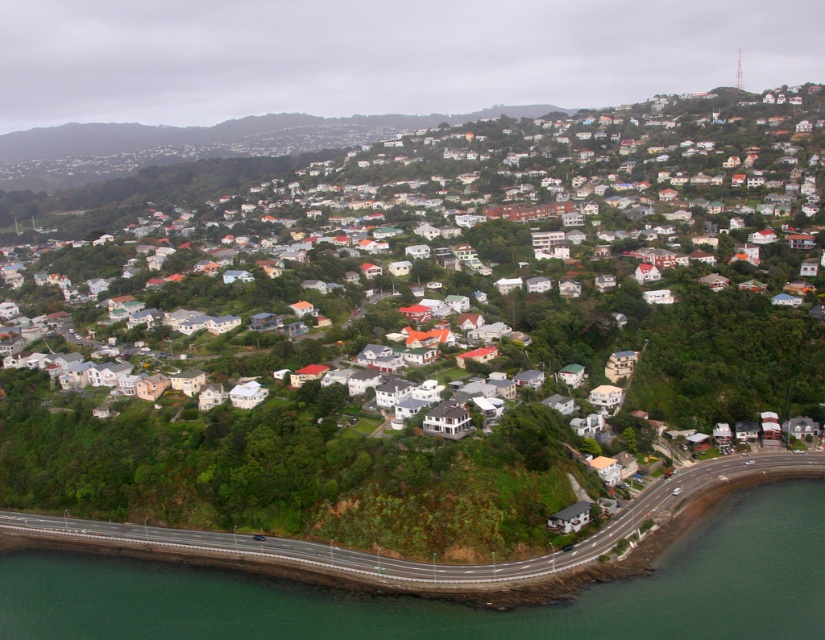
Find the location of a particular element. The height and width of the screenshot is (640, 825). white matte houses at center is located at coordinates (456, 323).

Can you confirm if white matte houses at center is wider than green water at lower left?

Indeed, white matte houses at center has a greater width compared to green water at lower left.

Is point (493, 540) closer to camera compared to point (639, 600)?

No, it is behind (639, 600).

Find the location of `white matte houses at center`. white matte houses at center is located at coordinates (456, 323).